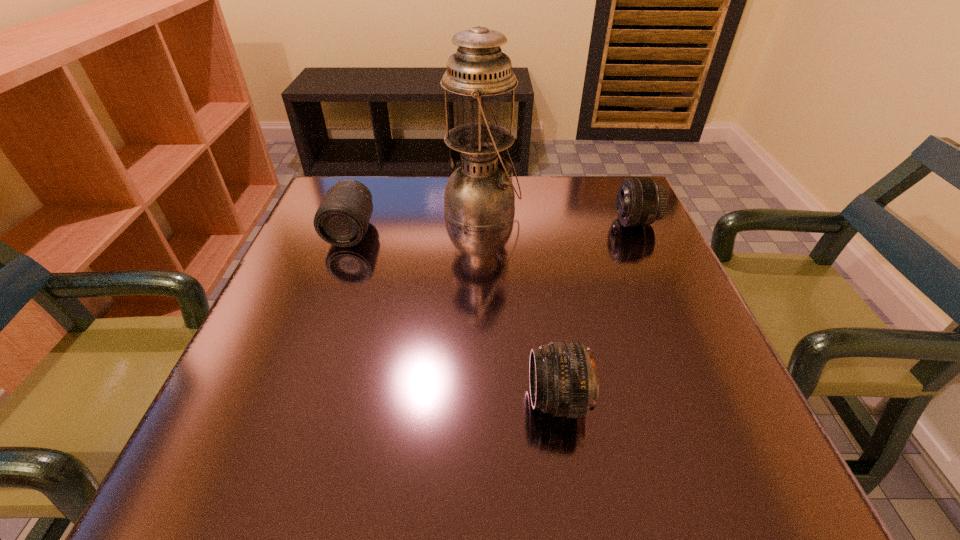
Where is `the tallest object`? The image size is (960, 540). the tallest object is located at coordinates (479, 195).

The image size is (960, 540). I want to click on the rightmost object, so click(640, 202).

Where is `the leftmost object`? The width and height of the screenshot is (960, 540). the leftmost object is located at coordinates click(x=342, y=219).

Find the location of a particular element. Image resolution: width=960 pixels, height=540 pixels. the nearest object is located at coordinates (563, 382).

At what (x,y) coordinates should I click in order to perform the action: click on the second telephoto lens from left to right. Please return your answer as a coordinate pair (x, y). This screenshot has width=960, height=540. Looking at the image, I should click on (563, 382).

The width and height of the screenshot is (960, 540). What are the coordinates of `free point located on the right of the tallest object` in the screenshot? It's located at (553, 210).

Locate an element on the screen. The image size is (960, 540). vacant region located 0.210m on the front-facing side of the rightmost telephoto lens is located at coordinates (526, 222).

The width and height of the screenshot is (960, 540). Identify the location of free location located 0.050m on the front-facing side of the rightmost telephoto lens. (594, 222).

The image size is (960, 540). What are the coordinates of `free point located on the front-facing side of the rightmost telephoto lens` in the screenshot? It's located at (459, 222).

Locate an element on the screen. vacant space located 0.280m on the surface of the leftmost telephoto lens is located at coordinates (307, 352).